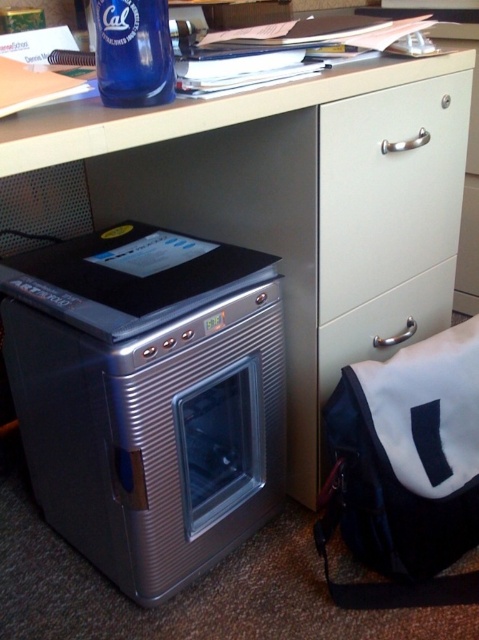
Question: Which object appears farthest from the camera in this image?

Choices:
 (A) white matte drawer at center right
 (B) matte white desk at upper center
 (C) white fabric bag at lower right

Answer: (A)

Question: Observing the image, what is the correct spatial positioning of white matte cabinet handle at center in reference to blue glass bottle at upper left?

Choices:
 (A) right
 (B) left

Answer: (A)

Question: Which of these objects is positioned farthest from the white matte drawer at center right?

Choices:
 (A) satin silver oven at lower left
 (B) white fabric bag at lower right

Answer: (A)

Question: Is blue glass bottle at upper left to the right of white matte drawer at center right from the viewer's perspective?

Choices:
 (A) no
 (B) yes

Answer: (A)

Question: Among these points, which one is nearest to the camera?

Choices:
 (A) (374, 278)
 (B) (330, 88)

Answer: (B)

Question: Is white fabric bag at lower right thinner than white matte drawer at center right?

Choices:
 (A) yes
 (B) no

Answer: (B)